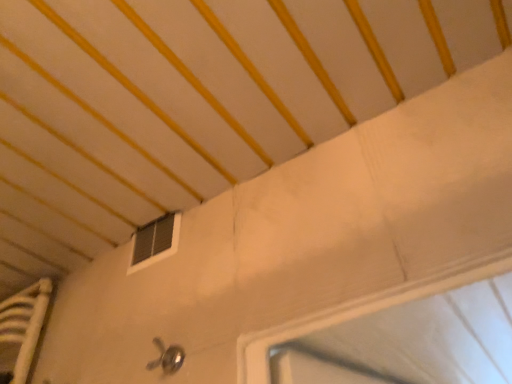
Where is `polished metallic door handle at lower center`? The image size is (512, 384). polished metallic door handle at lower center is located at coordinates (167, 357).

Measure the distance between point (152, 362) and camera.

The distance of point (152, 362) from camera is 32.83 inches.

The image size is (512, 384). What do you see at coordinates (167, 357) in the screenshot? I see `polished metallic door handle at lower center` at bounding box center [167, 357].

At what (x,y) coordinates should I click in order to perform the action: click on black plastic window at upper center. Please return your answer as a coordinate pair (x, y). Looking at the image, I should click on (155, 241).

What do you see at coordinates (155, 241) in the screenshot? Image resolution: width=512 pixels, height=384 pixels. I see `black plastic window at upper center` at bounding box center [155, 241].

Find the location of `polished metallic door handle at lower center`. polished metallic door handle at lower center is located at coordinates (167, 357).

From the picture: Between polished metallic door handle at lower center and black plastic window at upper center, which one appears on the left side from the viewer's perspective?

black plastic window at upper center.

Does polished metallic door handle at lower center lie behind black plastic window at upper center?

That is False.

Is point (173, 350) closer or farther from the camera than point (167, 215)?

Point (173, 350) is closer to the camera than point (167, 215).

In the scene shown: From the image's perspective, is polished metallic door handle at lower center located above or below black plastic window at upper center?

From the image's perspective, polished metallic door handle at lower center appears below black plastic window at upper center.

From a real-world perspective, which object stands above the other?

From a 3D spatial view, black plastic window at upper center is above.

Looking at this image, considering the sizes of objects polished metallic door handle at lower center and black plastic window at upper center in the image provided, who is thinner, polished metallic door handle at lower center or black plastic window at upper center?

black plastic window at upper center.

Considering the sizes of objects polished metallic door handle at lower center and black plastic window at upper center in the image provided, who is taller, polished metallic door handle at lower center or black plastic window at upper center?

With more height is black plastic window at upper center.

Which of these two, polished metallic door handle at lower center or black plastic window at upper center, is smaller?

polished metallic door handle at lower center.

Would you say polished metallic door handle at lower center contains black plastic window at upper center?

That's incorrect, black plastic window at upper center is not inside polished metallic door handle at lower center.

Is polished metallic door handle at lower center positioned far away from black plastic window at upper center?

polished metallic door handle at lower center is actually quite close to black plastic window at upper center.

Is polished metallic door handle at lower center facing towards black plastic window at upper center?

No, polished metallic door handle at lower center is not aimed at black plastic window at upper center.

How different are the orientations of polished metallic door handle at lower center and black plastic window at upper center in degrees?

0.000655 degrees separate the facing orientations of polished metallic door handle at lower center and black plastic window at upper center.

This screenshot has width=512, height=384. In order to click on door handle below the black plastic window at upper center (from a real-world perspective) in this screenshot , I will do `click(167, 357)`.

Between black plastic window at upper center and polished metallic door handle at lower center, which one appears on the right side from the viewer's perspective?

From the viewer's perspective, polished metallic door handle at lower center appears more on the right side.

Which is in front, black plastic window at upper center or polished metallic door handle at lower center?

Positioned in front is polished metallic door handle at lower center.

Which is farther from the camera, (145, 241) or (156, 366)?

Positioned behind is point (145, 241).

From the image's perspective, relative to polished metallic door handle at lower center, is black plastic window at upper center above or below?

black plastic window at upper center is situated higher than polished metallic door handle at lower center in the image.

From a real-world perspective, is black plastic window at upper center physically above polished metallic door handle at lower center?

Yes.

Does black plastic window at upper center have a lesser width compared to polished metallic door handle at lower center?

Correct, the width of black plastic window at upper center is less than that of polished metallic door handle at lower center.

Can you confirm if black plastic window at upper center is shorter than polished metallic door handle at lower center?

Incorrect, the height of black plastic window at upper center does not fall short of that of polished metallic door handle at lower center.

Is black plastic window at upper center bigger than polished metallic door handle at lower center?

Yes.

Would you say black plastic window at upper center is outside polished metallic door handle at lower center?

Absolutely, black plastic window at upper center is external to polished metallic door handle at lower center.

Looking at this image, are black plastic window at upper center and polished metallic door handle at lower center far apart?

No, black plastic window at upper center is in close proximity to polished metallic door handle at lower center.

Could you tell me if black plastic window at upper center is facing polished metallic door handle at lower center?

No, black plastic window at upper center is not oriented towards polished metallic door handle at lower center.

Locate an element on the screen. window above the polished metallic door handle at lower center (from the image's perspective) is located at coordinates (155, 241).

In order to click on door handle on the right side of black plastic window at upper center in this screenshot , I will do pos(167,357).

Locate an element on the screen. window positioned vertically above the polished metallic door handle at lower center (from a real-world perspective) is located at coordinates (155, 241).